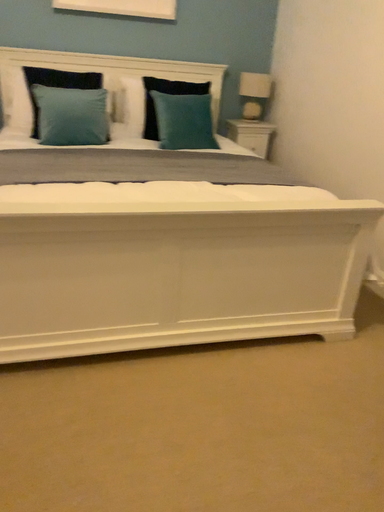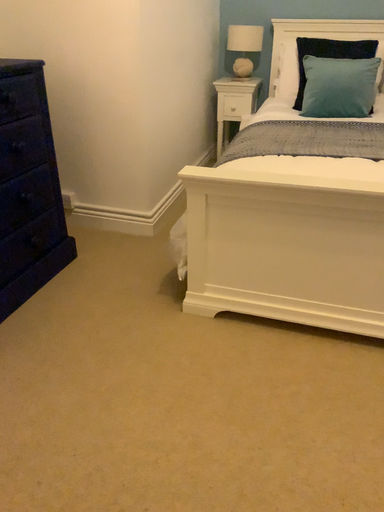
Question: Which way did the camera rotate in the video?

Choices:
 (A) rotated left
 (B) rotated right

Answer: (A)